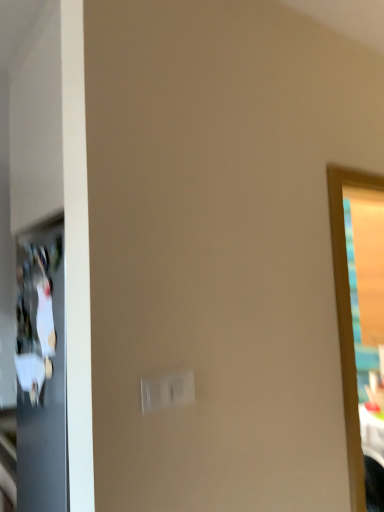
The image size is (384, 512). What do you see at coordinates (41, 373) in the screenshot?
I see `white glossy screen door at left` at bounding box center [41, 373].

This screenshot has width=384, height=512. In order to click on white glossy screen door at left in this screenshot , I will do `click(41, 373)`.

You are a GUI agent. You are given a task and a screenshot of the screen. Output one action in this format:
    pyautogui.click(x=<x>, y=<y>)
    Task: Click on the white glossy screen door at left
    This screenshot has width=384, height=512.
    Given the screenshot: What is the action you would take?
    pyautogui.click(x=41, y=373)